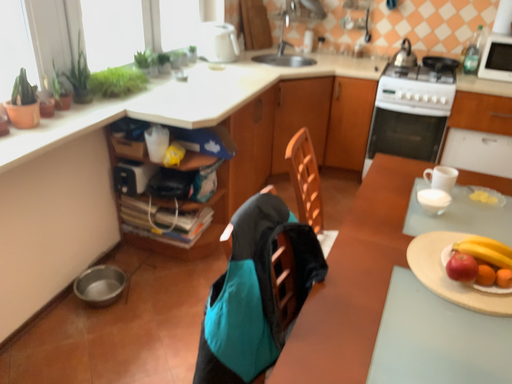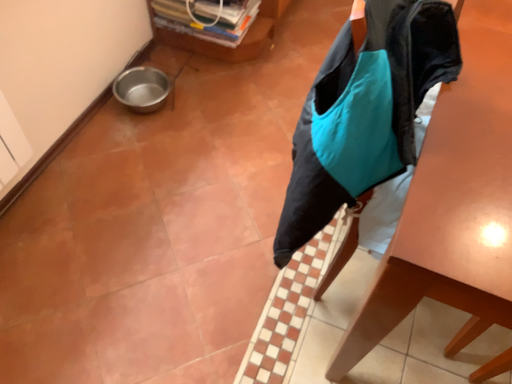
Question: Which way did the camera rotate in the video?

Choices:
 (A) rotated upward
 (B) rotated downward

Answer: (B)